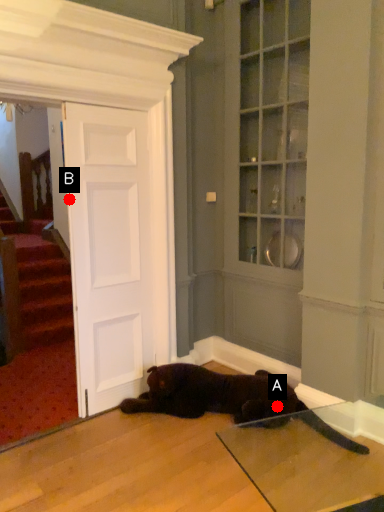
Question: Two points are circled on the image, labeled by A and B beside each circle. Which point appears farthest from the camera in this image?

Choices:
 (A) A is further
 (B) B is further

Answer: (A)